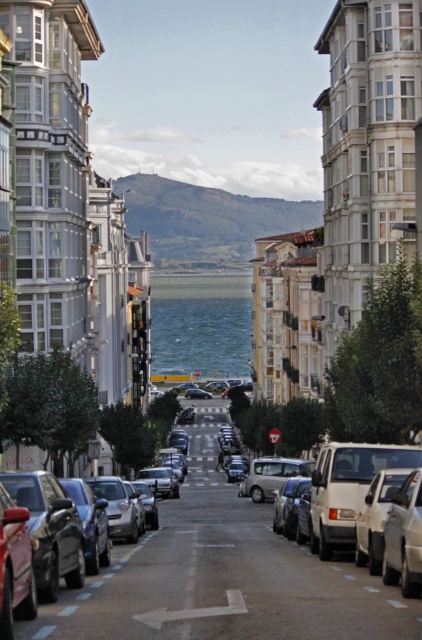
Who is more forward, (243, 308) or (352, 464)?

Point (352, 464) is in front.

This screenshot has height=640, width=422. What are the coordinates of `clear water at center` in the screenshot? It's located at (200, 324).